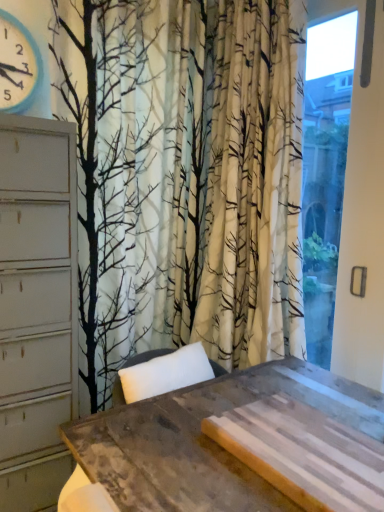
This screenshot has width=384, height=512. What do you see at coordinates (17, 65) in the screenshot? I see `blue plastic clock at upper left` at bounding box center [17, 65].

I want to click on rustic wood table at center, so click(x=240, y=445).

In order to click on blue plastic clock at upper left in this screenshot , I will do `click(17, 65)`.

Locate an element on the screen. This screenshot has height=512, width=384. window lying behind the rustic wood table at center is located at coordinates (325, 172).

In the scene shown: Considering their positions, is rustic wood table at center located in front of or behind transparent glass window at right?

rustic wood table at center is in front of transparent glass window at right.

Does rustic wood table at center have a lesser width compared to transparent glass window at right?

No, rustic wood table at center is not thinner than transparent glass window at right.

Is point (152, 432) farther from camera compared to point (306, 237)?

No, (152, 432) is in front of (306, 237).

Is blue plastic clock at upper left wider or thinner than rustic wood table at center?

Clearly, blue plastic clock at upper left has less width compared to rustic wood table at center.

From a real-world perspective, between blue plastic clock at upper left and rustic wood table at center, who is vertically lower?

rustic wood table at center.

Is blue plastic clock at upper left not inside rustic wood table at center?

Absolutely, blue plastic clock at upper left is external to rustic wood table at center.

Can you confirm if blue plastic clock at upper left is positioned to the right of rustic wood table at center?

Incorrect, blue plastic clock at upper left is not on the right side of rustic wood table at center.

Between point (9, 101) and point (332, 28), which one is positioned behind?

The point (332, 28) is more distant.

Between blue plastic clock at upper left and transparent glass window at right, which one is positioned in front?

transparent glass window at right is more forward.

Is blue plastic clock at upper left directly adjacent to transparent glass window at right?

No, blue plastic clock at upper left is not beside transparent glass window at right.

Is transparent glass window at right a part of blue plastic clock at upper left?

No, transparent glass window at right is not a part of blue plastic clock at upper left.

From the image's perspective, is rustic wood table at center under blue plastic clock at upper left?

Yes.

How different are the orientations of rustic wood table at center and blue plastic clock at upper left in degrees?

There is a 0.00347-degree angle between the facing directions of rustic wood table at center and blue plastic clock at upper left.

Can you confirm if rustic wood table at center is bigger than blue plastic clock at upper left?

Indeed, rustic wood table at center has a larger size compared to blue plastic clock at upper left.

From a real-world perspective, which is physically below, rustic wood table at center or blue plastic clock at upper left?

rustic wood table at center, from a real-world perspective.

From the image's perspective, would you say transparent glass window at right is shown under blue plastic clock at upper left?

Yes, from the image's perspective, transparent glass window at right is beneath blue plastic clock at upper left.

Would you say blue plastic clock at upper left is part of transparent glass window at right's contents?

No, blue plastic clock at upper left is not a part of transparent glass window at right.

Is point (346, 20) farther from viewer compared to point (17, 60)?

Yes.

Between transparent glass window at right and blue plastic clock at upper left, which one has more height?

transparent glass window at right is taller.

Is point (304, 191) farther from viewer compared to point (362, 472)?

Yes, point (304, 191) is behind point (362, 472).

Considering the sizes of objects transparent glass window at right and rustic wood table at center in the image provided, who is smaller, transparent glass window at right or rustic wood table at center?

Smaller between the two is transparent glass window at right.

In the scene shown: Choose the correct answer: Is transparent glass window at right inside rustic wood table at center or outside it?

transparent glass window at right is located beyond the bounds of rustic wood table at center.

Image resolution: width=384 pixels, height=512 pixels. I want to click on table below the transparent glass window at right (from the image's perspective), so click(240, 445).

Identify the location of window located behind the rustic wood table at center. The width and height of the screenshot is (384, 512). (325, 172).

Identify the location of table below the blue plastic clock at upper left (from the image's perspective). (240, 445).

Estimate the real-world distances between objects in this image. Which object is further from transparent glass window at right, blue plastic clock at upper left or rustic wood table at center?

blue plastic clock at upper left lies further to transparent glass window at right than the other object.

Which object lies nearer to the anchor point rustic wood table at center, blue plastic clock at upper left or transparent glass window at right?

transparent glass window at right lies closer to rustic wood table at center than the other object.

Estimate the real-world distances between objects in this image. Which object is closer to blue plastic clock at upper left, transparent glass window at right or rustic wood table at center?

transparent glass window at right is positioned closer to the anchor blue plastic clock at upper left.

In the scene shown: When comparing their distances from transparent glass window at right, does rustic wood table at center or blue plastic clock at upper left seem further?

The object further to transparent glass window at right is blue plastic clock at upper left.

Which object lies nearer to the anchor point blue plastic clock at upper left, rustic wood table at center or transparent glass window at right?

transparent glass window at right is closer to blue plastic clock at upper left.

Looking at the image, which one is located closer to rustic wood table at center, transparent glass window at right or blue plastic clock at upper left?

Among the two, transparent glass window at right is located nearer to rustic wood table at center.

Identify the location of window between blue plastic clock at upper left and rustic wood table at center vertically. (325, 172).